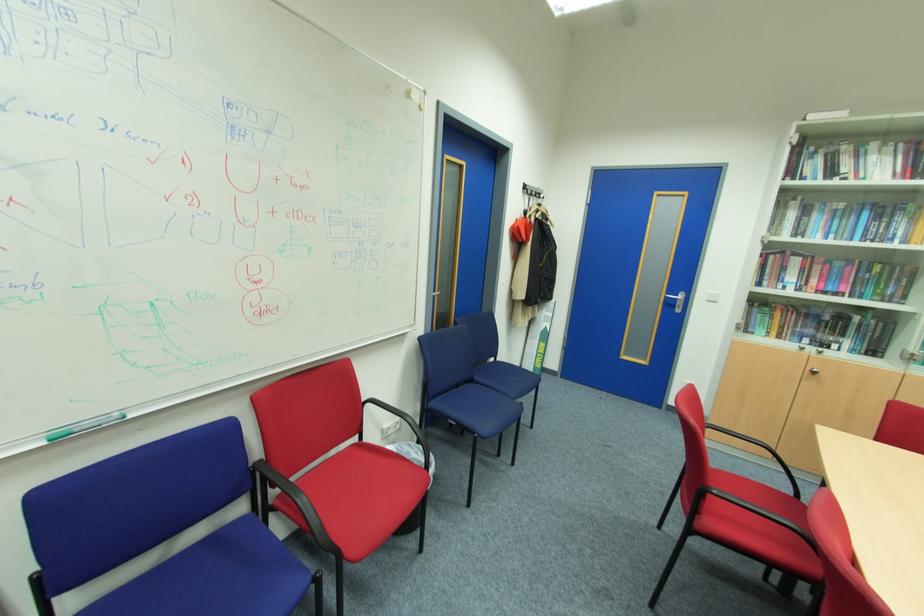
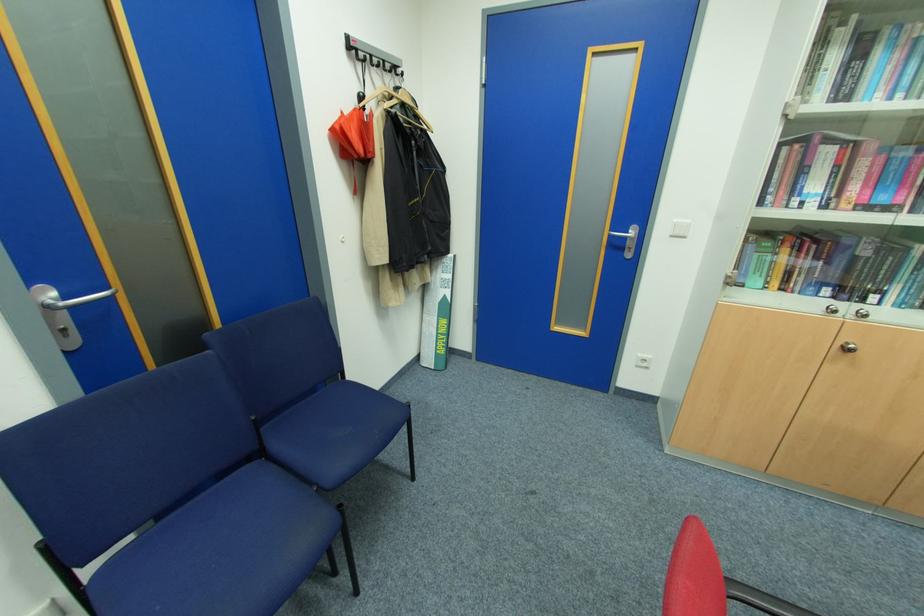
In the second image, find the point that corresponds to point 711,301 in the first image.

(675, 236)